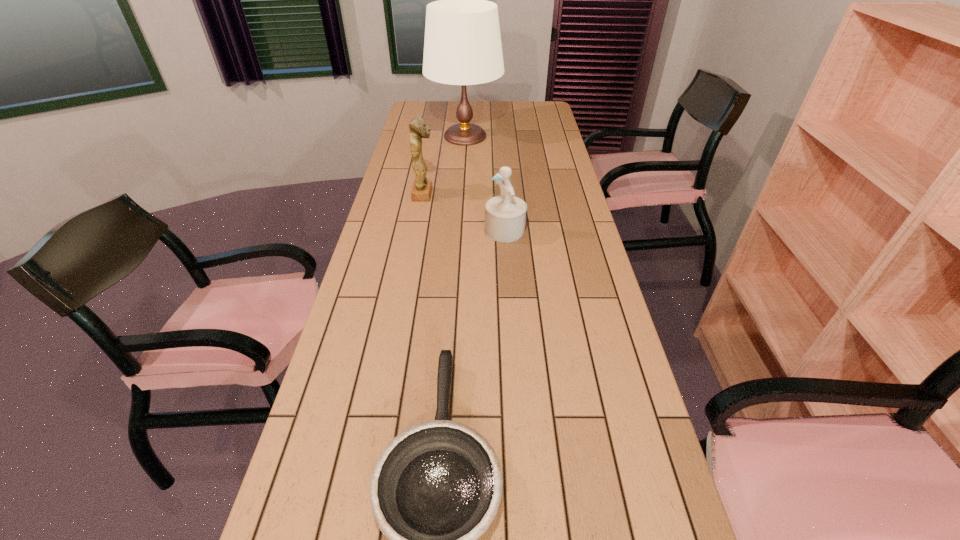
At what (x,y) coordinates should I click in order to perform the action: click on the farthest object. Please return your answer as a coordinate pair (x, y). Looking at the image, I should click on (462, 46).

This screenshot has width=960, height=540. I want to click on the tallest object, so click(x=462, y=46).

Locate an element on the screen. This screenshot has width=960, height=540. the farther figurine is located at coordinates (422, 188).

Identify the location of the taller figurine. (422, 188).

Identify the location of the nearer figurine. (505, 215).

The height and width of the screenshot is (540, 960). What are the coordinates of `the shorter figurine` in the screenshot? It's located at pos(505,215).

Identify the location of vacant space located 0.210m on the back of the tallest object. (467, 105).

Identify the location of vacant space located 0.360m on the front-facing side of the second farthest object. (531, 194).

Where is `vacant area situated 0.280m at the beak of the nearer figurine`? vacant area situated 0.280m at the beak of the nearer figurine is located at coordinates (401, 231).

The height and width of the screenshot is (540, 960). I want to click on free space located at the beak of the nearer figurine, so click(x=407, y=231).